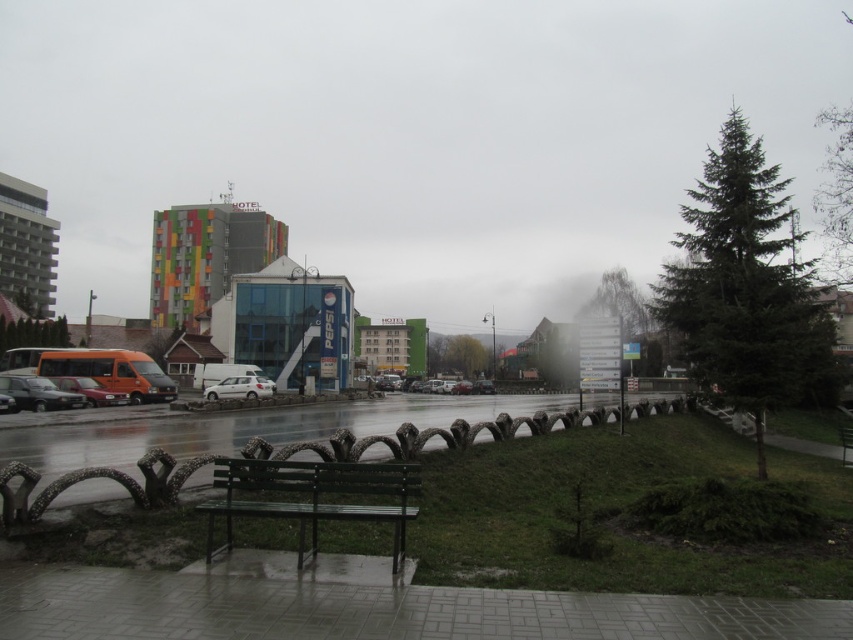
Question: Which point is farther to the camera?

Choices:
 (A) green matte bench at lower center
 (B) shiny silver sedan at lower left
 (C) white matte car at center

Answer: (C)

Question: Which point is closer to the camera?

Choices:
 (A) (57, 376)
 (B) (225, 381)
 (C) (259, 477)
 (D) (28, 404)

Answer: (C)

Question: Does green matte bench at lower center appear on the right side of shiny silver car at lower left?

Choices:
 (A) yes
 (B) no

Answer: (A)

Question: Does green matte bench at lower center have a greater width compared to shiny silver car at lower left?

Choices:
 (A) yes
 (B) no

Answer: (B)

Question: Does green matte bench at lower center have a larger size compared to white matte car at center?

Choices:
 (A) yes
 (B) no

Answer: (B)

Question: Which object is positioned closest to the green matte bench at lower center?

Choices:
 (A) white matte car at center
 (B) shiny silver sedan at lower left
 (C) shiny silver car at lower left

Answer: (B)